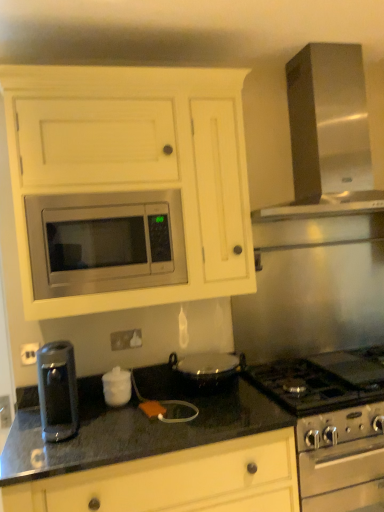
What do you see at coordinates (329, 124) in the screenshot?
I see `satin silver exhaust hood at upper right` at bounding box center [329, 124].

How much space does white glossy sugar bowl at center, acting as the first appliance starting from the top, occupy horizontally?

The width of white glossy sugar bowl at center, acting as the first appliance starting from the top, is 7.43 inches.

The width and height of the screenshot is (384, 512). What do you see at coordinates (117, 387) in the screenshot? I see `white glossy sugar bowl at center, which is the 2th appliance from right to left` at bounding box center [117, 387].

What is the approximate width of white glossy electric outlet at center?

white glossy electric outlet at center is 1.32 centimeters wide.

In order to click on stainless steel microwave at center in this screenshot , I will do `click(105, 242)`.

In order to face stainless steel microwave at center, should I rotate leftwards or rightwards?

You should look left and rotate roughly 12.509 degrees.

You are a GUI agent. You are given a task and a screenshot of the screen. Output one action in this format:
    pyautogui.click(x=<x>, y=<y>)
    Task: Click on the satin metallic coffee maker at lower left
    The width and height of the screenshot is (384, 512).
    Given the screenshot: What is the action you would take?
    pyautogui.click(x=57, y=391)

At what (x,y) coordinates should I click in order to perform the action: click on black granite countertop at lower center. Please return your answer as a coordinate pair (x, y). This screenshot has width=384, height=512. Looking at the image, I should click on (213, 444).

From a real-world perspective, is matte white cabinet at upper center on top of stainless steel microwave at center?

Yes, from a real-world perspective, matte white cabinet at upper center is above stainless steel microwave at center.

What's the angular difference between matte white cabinet at upper center and stainless steel microwave at center's facing directions?

The facing directions of matte white cabinet at upper center and stainless steel microwave at center are 0.4 degrees apart.

Is matte white cabinet at upper center placed right next to stainless steel microwave at center?

matte white cabinet at upper center is not next to stainless steel microwave at center, and they're not touching.

Based on their sizes in the image, would you say matte white cabinet at upper center is bigger or smaller than stainless steel microwave at center?

Considering their sizes, matte white cabinet at upper center takes up more space than stainless steel microwave at center.

Can you confirm if satin silver exhaust hood at upper right is bigger than satin metallic coffee maker at lower left?

Yes.

Measure the distance between satin silver exhaust hood at upper right and satin metallic coffee maker at lower left.

A distance of 5.23 feet exists between satin silver exhaust hood at upper right and satin metallic coffee maker at lower left.

Does satin silver exhaust hood at upper right turn towards satin metallic coffee maker at lower left?

No, satin silver exhaust hood at upper right is not oriented towards satin metallic coffee maker at lower left.

Is satin silver exhaust hood at upper right situated inside satin metallic coffee maker at lower left or outside?

satin silver exhaust hood at upper right lies outside satin metallic coffee maker at lower left.

Which object is positioned more to the left, white glossy electric outlet at center or matte white cabinet at upper center?

white glossy electric outlet at center is more to the left.

Considering the sizes of white glossy electric outlet at center and matte white cabinet at upper center in the image, is white glossy electric outlet at center taller or shorter than matte white cabinet at upper center?

Considering their sizes, white glossy electric outlet at center has less height than matte white cabinet at upper center.

Between white glossy electric outlet at center and matte white cabinet at upper center, which one has smaller size?

With smaller size is white glossy electric outlet at center.

Which is nearer, (137,335) or (232,144)?

Point (137,335).

Is satin silver exhaust hood at upper right in contact with stainless steel microwave at center?

No, satin silver exhaust hood at upper right is not touching stainless steel microwave at center.

Is satin silver exhaust hood at upper right bigger than stainless steel microwave at center?

Correct, satin silver exhaust hood at upper right is larger in size than stainless steel microwave at center.

Consider the image. From the image's perspective, is satin silver exhaust hood at upper right over stainless steel microwave at center?

Indeed, from the image's perspective, satin silver exhaust hood at upper right is shown above stainless steel microwave at center.

Which object is thinner, satin silver exhaust hood at upper right or matte white cabinet at upper center?

matte white cabinet at upper center is thinner.

Is satin silver exhaust hood at upper right oriented towards matte white cabinet at upper center?

No, satin silver exhaust hood at upper right is not aimed at matte white cabinet at upper center.

Considering the sizes of objects satin silver exhaust hood at upper right and matte white cabinet at upper center in the image provided, who is taller, satin silver exhaust hood at upper right or matte white cabinet at upper center?

With more height is matte white cabinet at upper center.

Would you consider stainless steel microwave at center to be distant from black granite countertop at lower center?

They are positioned close to each other.

Is stainless steel microwave at center looking in the opposite direction of black granite countertop at lower center?

That's not correct — stainless steel microwave at center is not looking away from black granite countertop at lower center.

From the image's perspective, which is above, stainless steel microwave at center or black granite countertop at lower center?

From the image's view, stainless steel microwave at center is above.

From the picture: Is stainless steel microwave at center to the right of black granite countertop at lower center from the viewer's perspective?

Incorrect, stainless steel microwave at center is not on the right side of black granite countertop at lower center.

How much distance is there between satin metallic coffee maker at lower left and satin silver exhaust hood at upper right?

5.23 feet.

Is satin metallic coffee maker at lower left touching satin silver exhaust hood at upper right?

No, satin metallic coffee maker at lower left is not touching satin silver exhaust hood at upper right.

From the image's perspective, would you say satin metallic coffee maker at lower left is shown under satin silver exhaust hood at upper right?

Yes.

From a real-world perspective, is satin metallic coffee maker at lower left below satin silver exhaust hood at upper right?

Indeed, from a real-world perspective, satin metallic coffee maker at lower left is positioned beneath satin silver exhaust hood at upper right.

Where is `microwave oven beneath the matte white cabinet at upper center (from a real-world perspective)`? microwave oven beneath the matte white cabinet at upper center (from a real-world perspective) is located at coordinates (105, 242).

This screenshot has width=384, height=512. I want to click on exhaust hood that appears above the satin metallic coffee maker at lower left (from the image's perspective), so click(x=329, y=124).

Considering their positions, is satin silver stove at lower right, the 1th appliance viewed from the right, positioned closer to stainless steel microwave at center than matte white cabinet at upper center?

matte white cabinet at upper center lies closer to stainless steel microwave at center than the other object.

When comparing their distances from white glossy sugar bowl at center, which is the 2th appliance from right to left, does white glossy electric outlet at center or matte white cabinet at upper center seem closer?

Among the two, white glossy electric outlet at center is located nearer to white glossy sugar bowl at center, which is the 2th appliance from right to left.

Looking at the image, which one is located further to stainless steel microwave at center, white glossy electric outlet at center or satin silver exhaust hood at upper right?

satin silver exhaust hood at upper right is positioned further to the anchor stainless steel microwave at center.

From the image, which object appears to be nearer to satin silver stove at lower right, the 1th appliance viewed from the right, white glossy electric outlet at center or white glossy sugar bowl at center, acting as the first appliance starting from the top?

Based on the image, white glossy sugar bowl at center, acting as the first appliance starting from the top, appears to be nearer to satin silver stove at lower right, the 1th appliance viewed from the right.

When comparing their distances from black granite countertop at lower center, does satin silver stove at lower right, the second appliance from the top, or satin metallic coffee maker at lower left seem further?

satin metallic coffee maker at lower left is further to black granite countertop at lower center.

Considering their positions, is white glossy electric outlet at center positioned closer to white glossy sugar bowl at center, the 1th appliance viewed from the left, than satin silver exhaust hood at upper right?

Based on the image, white glossy electric outlet at center appears to be nearer to white glossy sugar bowl at center, the 1th appliance viewed from the left.

Considering their positions, is satin metallic coffee maker at lower left positioned closer to stainless steel microwave at center than white glossy electric outlet at center?

white glossy electric outlet at center is closer to stainless steel microwave at center.

Which object lies nearer to the anchor point black granite countertop at lower center, white glossy electric outlet at center or white glossy sugar bowl at center, the 1th appliance viewed from the left?

white glossy sugar bowl at center, the 1th appliance viewed from the left, is positioned closer to the anchor black granite countertop at lower center.

This screenshot has height=512, width=384. I want to click on electric outlet between satin silver exhaust hood at upper right and black granite countertop at lower center vertically, so click(126, 339).

The image size is (384, 512). Find the location of `cabinetry between stainless steel microwave at center and satin silver exhaust hood at upper right`. cabinetry between stainless steel microwave at center and satin silver exhaust hood at upper right is located at coordinates (136, 165).

Locate an element on the screen. Image resolution: width=384 pixels, height=512 pixels. microwave oven between satin silver exhaust hood at upper right and satin silver stove at lower right, the second appliance from the top, in the up-down direction is located at coordinates click(x=105, y=242).

Find the location of a particular element. Image resolution: width=384 pixels, height=512 pixels. kitchen appliance between matte white cabinet at upper center and white glossy sugar bowl at center, which is counted as the second appliance, starting from the bottom, in the up-down direction is located at coordinates (57, 391).